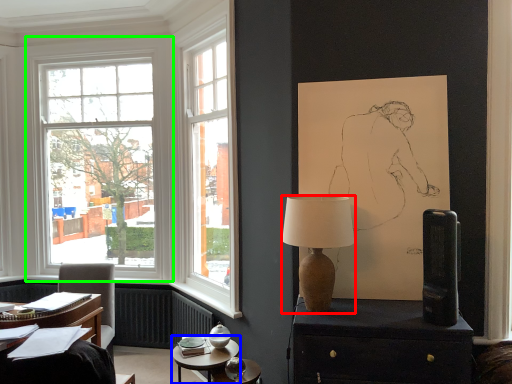
Question: Which object is the closest to the lamp (highlighted by a red box)? Choose among these: table (highlighted by a blue box) or window (highlighted by a green box).

Choices:
 (A) table
 (B) window

Answer: (A)